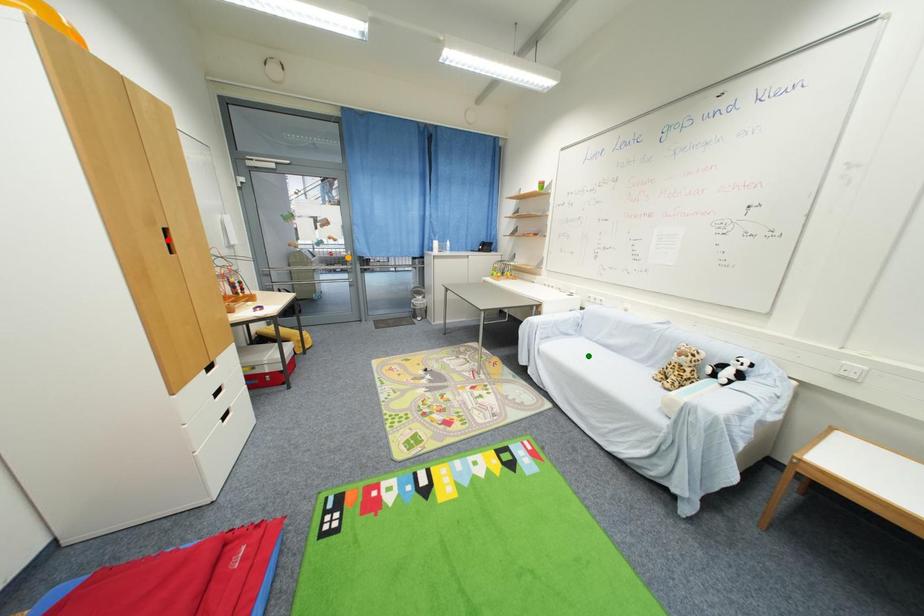
Order these from farthest to nearest:
green point
red point
orange point

orange point → green point → red point